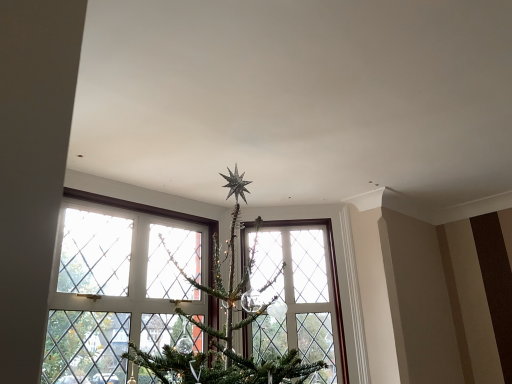
Describe the element at coordinates (304, 293) in the screenshot. I see `clear glass window at center` at that location.

This screenshot has height=384, width=512. I want to click on clear glass window at center, so click(x=304, y=293).

Where is `clear glass window at center`? The height and width of the screenshot is (384, 512). clear glass window at center is located at coordinates (304, 293).